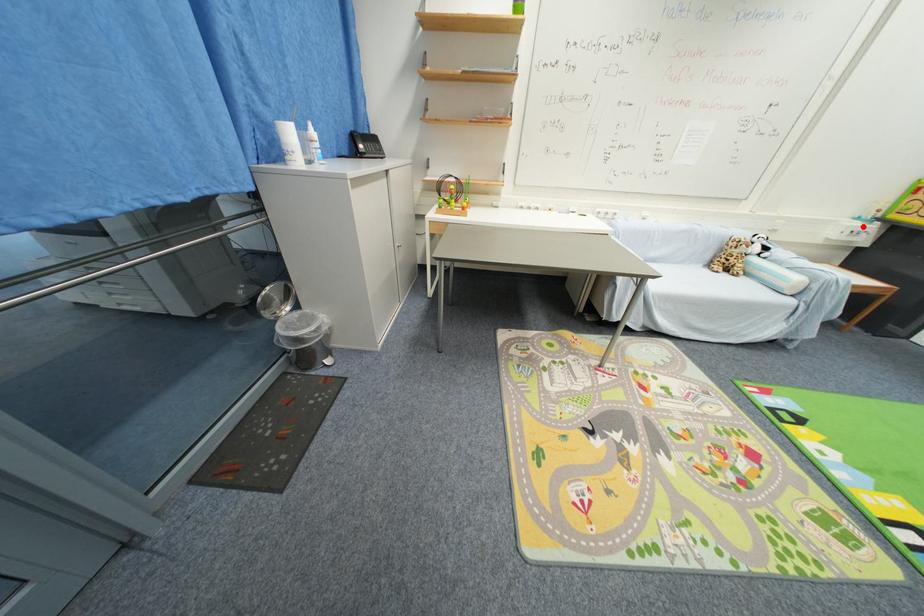
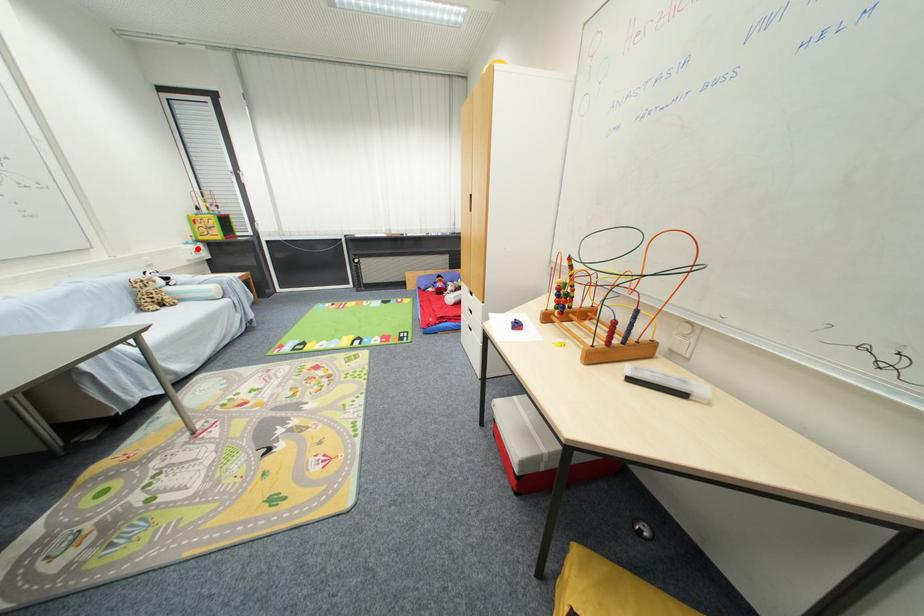
I am providing you with two images of the same scene from different viewpoints. A red point is marked on the first image and another point is marked on the second image. Does the point marked in image1 correspond to the same location as the one in image2?

Yes